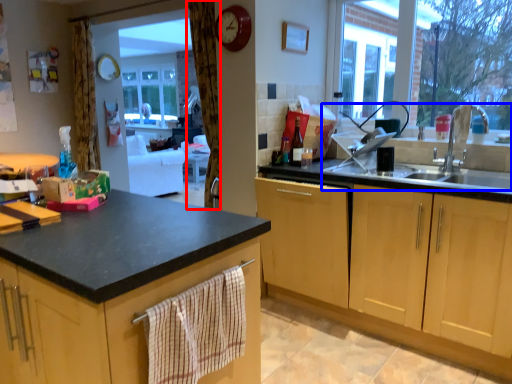
Question: Among these objects, which one is farthest to the camera, curtain (highlighted by a red box) or sink (highlighted by a blue box)?

Choices:
 (A) curtain
 (B) sink

Answer: (A)